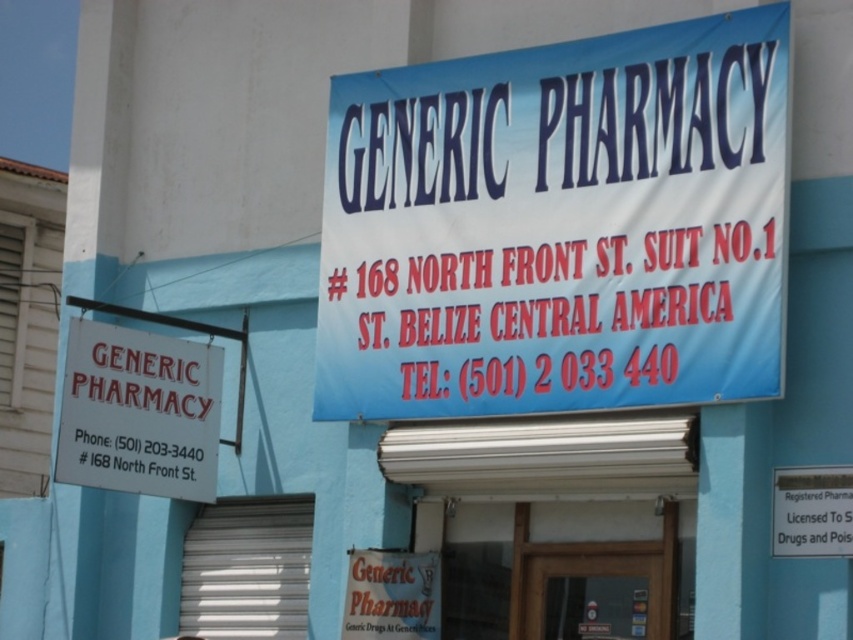
Question: Can you confirm if blue fabric sign at upper center is positioned to the left of white paper sign at upper left?

Choices:
 (A) no
 (B) yes

Answer: (A)

Question: Which object is closer to the camera taking this photo?

Choices:
 (A) white paper sign at upper left
 (B) blue fabric sign at upper center

Answer: (B)

Question: Does blue fabric sign at upper center appear over white paper sign at upper left?

Choices:
 (A) no
 (B) yes

Answer: (B)

Question: Where is blue fabric sign at upper center located in relation to white paper sign at upper left in the image?

Choices:
 (A) left
 (B) right

Answer: (B)

Question: Which point is farther from the camera taking this photo?

Choices:
 (A) (349, 221)
 (B) (71, 385)

Answer: (A)